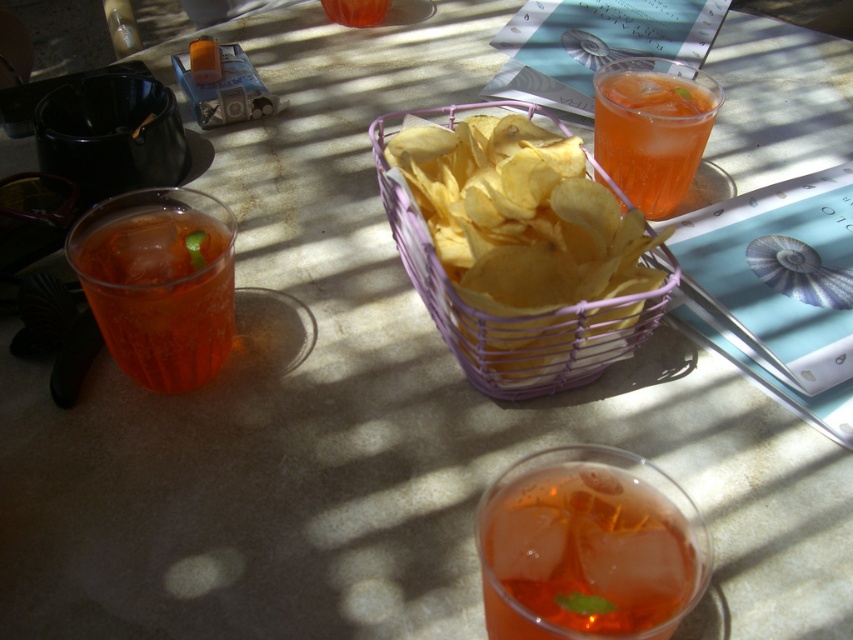
Is translucent glass drink at lower center below purple wire basket at center?

Yes.

Who is more distant from viewer, (511, 563) or (572, 333)?

Positioned behind is point (572, 333).

At what (x,y) coordinates should I click in order to perform the action: click on translucent glass drink at lower center. Please return your answer as a coordinate pair (x, y). Looking at the image, I should click on tap(584, 556).

How far apart are purple wire basket at center and translucent glass drink at upper right?

A distance of 13.33 centimeters exists between purple wire basket at center and translucent glass drink at upper right.

Which is more to the right, purple wire basket at center or translucent glass drink at upper right?

From the viewer's perspective, translucent glass drink at upper right appears more on the right side.

The image size is (853, 640). I want to click on purple wire basket at center, so click(512, 317).

Locate an element on the screen. The height and width of the screenshot is (640, 853). purple wire basket at center is located at coordinates (512, 317).

Does translucent glass drink at lower center have a greater height compared to translucent glass drink at upper right?

No.

Is point (506, 496) positioned in front of point (616, 81)?

Yes, point (506, 496) is in front of point (616, 81).

I want to click on translucent glass drink at lower center, so click(584, 556).